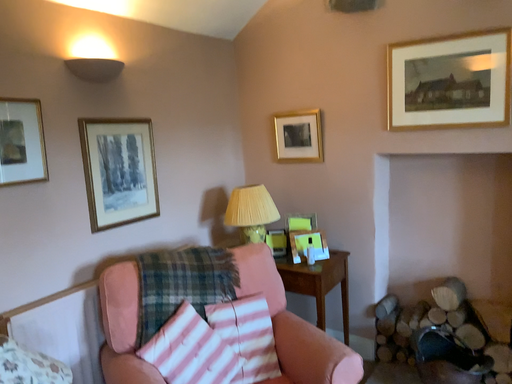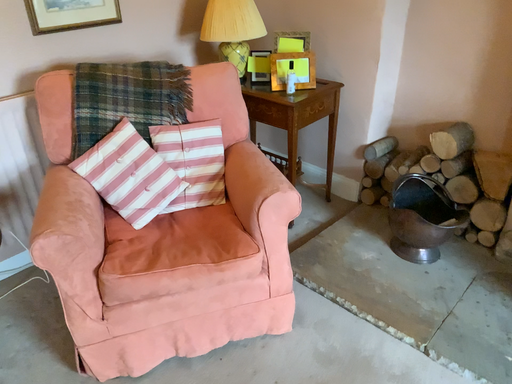
Question: Which way did the camera rotate in the video?

Choices:
 (A) rotated downward
 (B) rotated upward

Answer: (A)